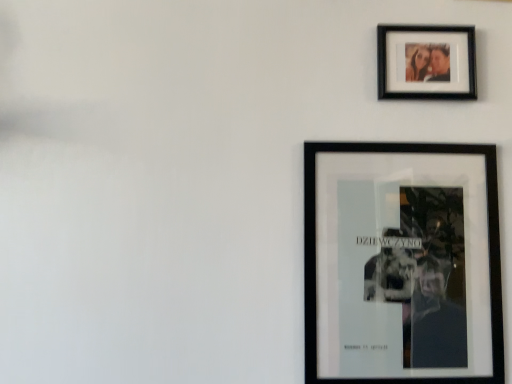
Question: From a real-world perspective, is black matte photo frame at upper right, which is the 2th picture frame from bottom to top, above or below black matte poster at lower right, which ranks as the first picture frame in bottom-to-top order?

Choices:
 (A) above
 (B) below

Answer: (A)

Question: From the image's perspective, is black matte photo frame at upper right, which is the 2th picture frame from bottom to top, above or below black matte poster at lower right, positioned as the 2th picture frame in top-to-bottom order?

Choices:
 (A) above
 (B) below

Answer: (A)

Question: In the image, is black matte photo frame at upper right, the 1th picture frame viewed from the top, positioned in front of or behind black matte poster at lower right, which ranks as the first picture frame in bottom-to-top order?

Choices:
 (A) front
 (B) behind

Answer: (B)

Question: Is black matte poster at lower right, which ranks as the first picture frame in bottom-to-top order, spatially inside black matte photo frame at upper right, which is the 2th picture frame from bottom to top, or outside of it?

Choices:
 (A) outside
 (B) inside

Answer: (A)

Question: Looking at their shapes, would you say black matte poster at lower right, which ranks as the first picture frame in bottom-to-top order, is wider or thinner than black matte photo frame at upper right, the 1th picture frame viewed from the top?

Choices:
 (A) thin
 (B) wide

Answer: (B)

Question: From a real-world perspective, is black matte poster at lower right, positioned as the 2th picture frame in top-to-bottom order, positioned above or below black matte photo frame at upper right, which is the 2th picture frame from bottom to top?

Choices:
 (A) below
 (B) above

Answer: (A)

Question: Visually, is black matte poster at lower right, positioned as the 2th picture frame in top-to-bottom order, positioned to the left or to the right of black matte photo frame at upper right, which is the 2th picture frame from bottom to top?

Choices:
 (A) right
 (B) left

Answer: (B)